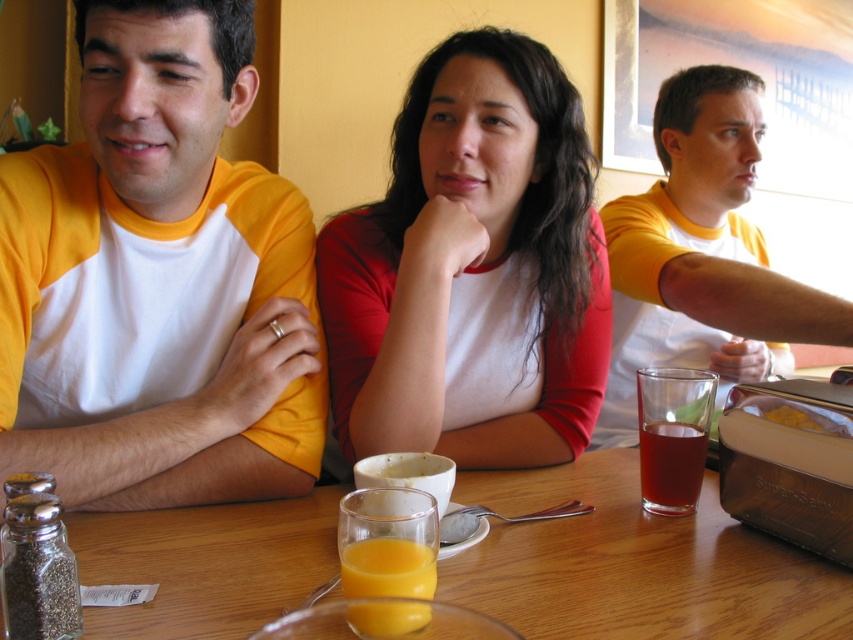
Is wooden table at center in front of orange translucent glass at center?

No, wooden table at center is further to the viewer.

Which is below, wooden table at center or orange translucent glass at center?

Positioned lower is wooden table at center.

This screenshot has height=640, width=853. What do you see at coordinates (635, 564) in the screenshot?
I see `wooden table at center` at bounding box center [635, 564].

Where is `wooden table at center`? wooden table at center is located at coordinates (635, 564).

The height and width of the screenshot is (640, 853). What do you see at coordinates (473, 269) in the screenshot? I see `matte white shirt at center` at bounding box center [473, 269].

Who is higher up, matte white shirt at center or orange translucent glass at center?

Positioned higher is matte white shirt at center.

Identify the location of matte white shirt at center. (473, 269).

Who is shorter, yellow cotton shirt at left or wooden table at center?

Standing shorter between the two is wooden table at center.

Is yellow cotton shirt at left positioned behind wooden table at center?

Yes, yellow cotton shirt at left is further from the viewer.

Who is more distant from viewer, (62, 346) or (120, 536)?

The point (62, 346) is more distant.

Locate an element on the screen. yellow cotton shirt at left is located at coordinates (158, 280).